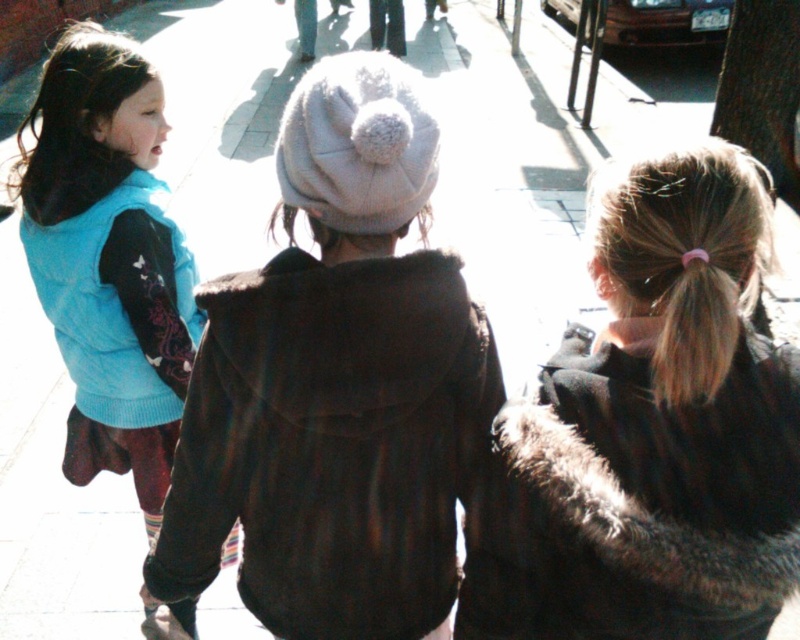
You are standing in the scene and want to hand a package to the person in the brown fur coat at center. To do so, should you walk towards the matte blue vest at left or away from it?

The brown fur coat at center is below the matte blue vest at left, so you should walk away from the matte blue vest at left to reach the brown fur coat at center.

You are standing in the outdoor scene and want to know which object is shorter. Can you tell me which one between the brown fur coat at center and the matte blue vest at left is shorter?

The brown fur coat at center is shorter than the matte blue vest at left.